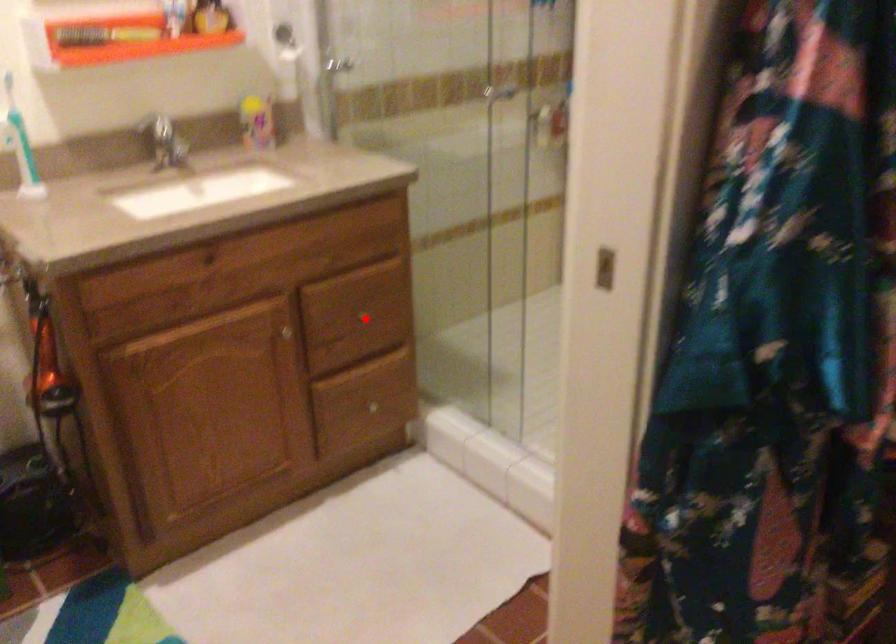
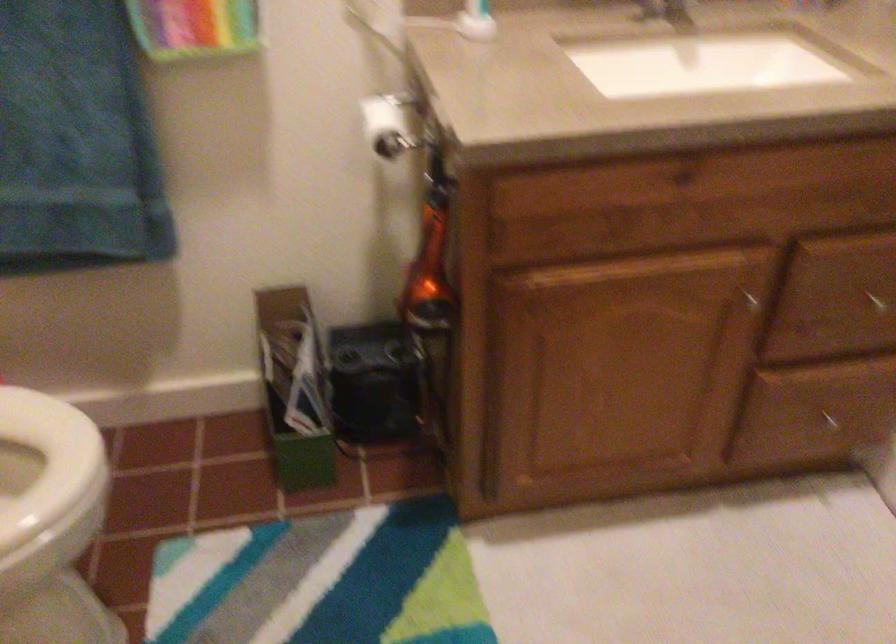
Locate, in the second image, the point that corresponds to the highlighted location in the first image.

(875, 301)